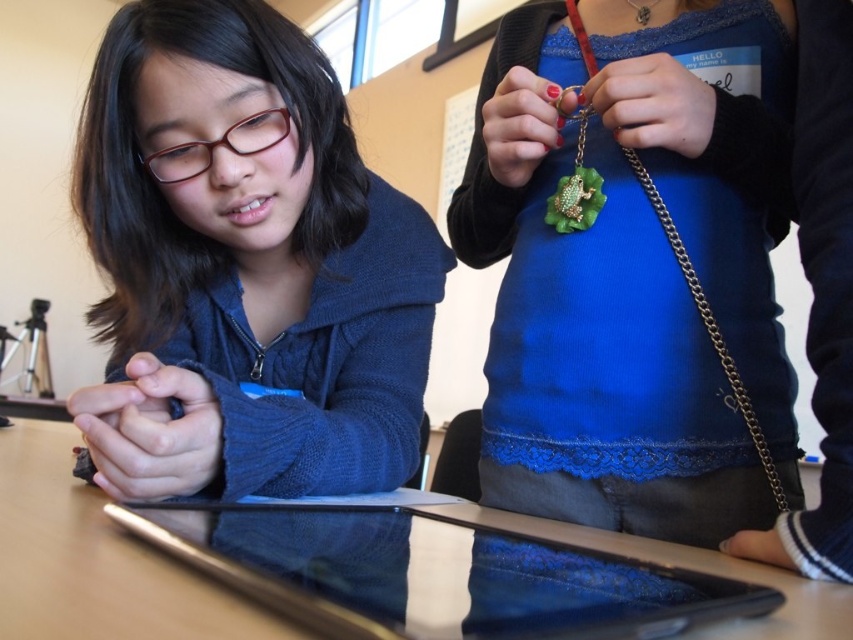
You are a photographer positioned at the camera. You want to capture a closeup shot of the green felt necklace at center. Considering your current position, is the necklace within your camera lens range for a clear closeup?

The green felt necklace at center is 18.37 inches away from the camera, which is within the typical closeup lens range, so yes, it can be captured clearly.